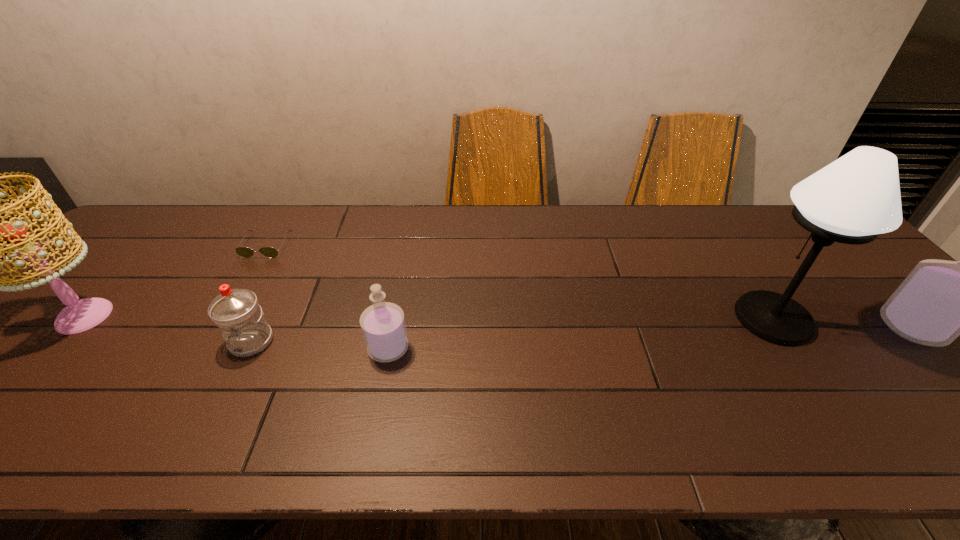
If the aim is uniform spacing by inserting an additional perfume among them, please point to a vacant space for this new perfume. Please provide its 2D coordinates. Your answer should be formatted as a tuple, i.e. [(x, y)], where the tuple contains the x and y coordinates of a point satisfying the conditions above.

[(656, 338)]